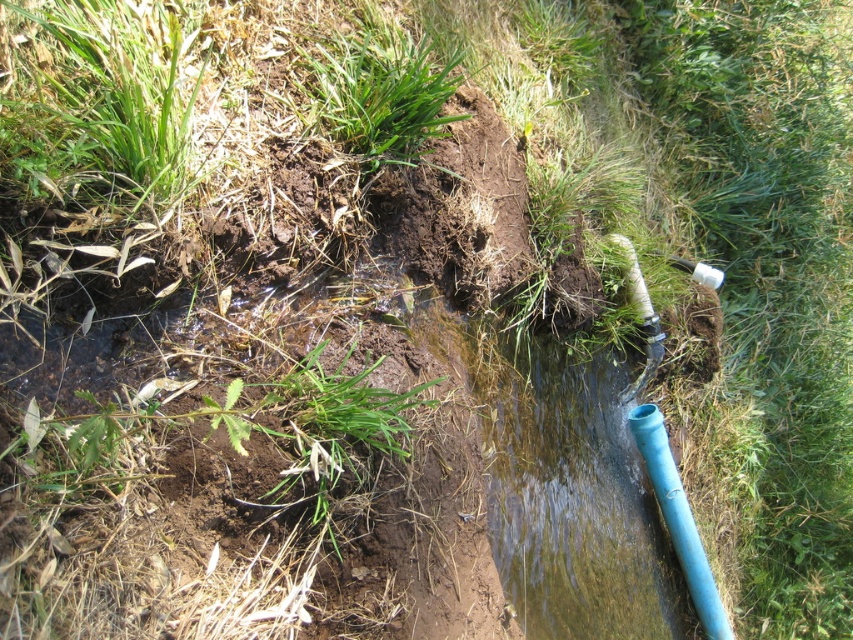
Question: Observing the image, what is the correct spatial positioning of green grass at center in reference to white textured hose at center right?

Choices:
 (A) below
 (B) above

Answer: (B)

Question: Which point is farther to the camera?

Choices:
 (A) (384, 156)
 (B) (697, 611)

Answer: (B)

Question: Among these points, which one is nearest to the camera?

Choices:
 (A) (349, 102)
 (B) (700, 611)
 (C) (631, 300)

Answer: (A)

Question: Does green grass at center appear over blue plastic pipe at lower right?

Choices:
 (A) yes
 (B) no

Answer: (A)

Question: Among these points, which one is nearest to the camera?

Choices:
 (A) (427, 125)
 (B) (703, 595)
 (C) (630, 268)

Answer: (A)

Question: From the image, what is the correct spatial relationship of blue plastic pipe at lower right in relation to white textured hose at center right?

Choices:
 (A) above
 (B) below

Answer: (B)